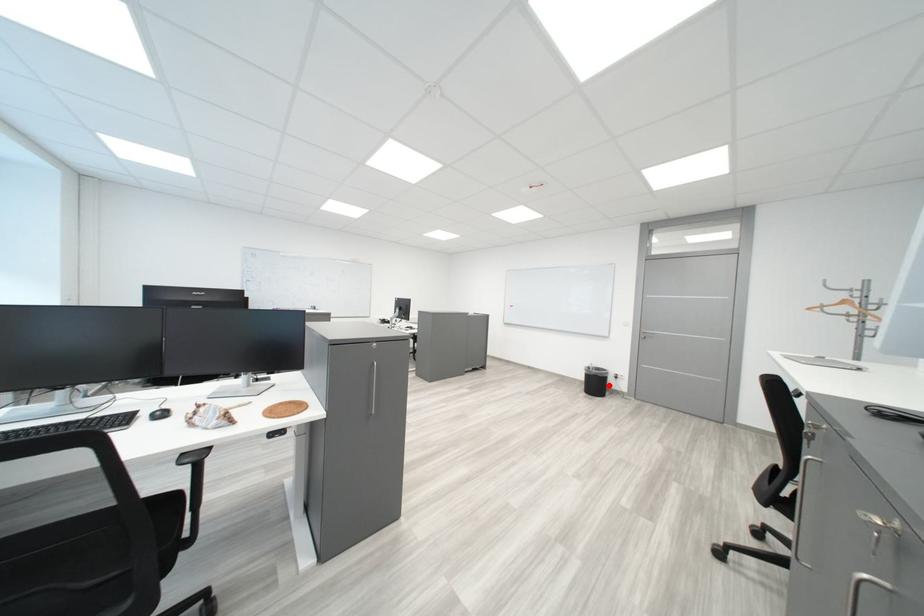
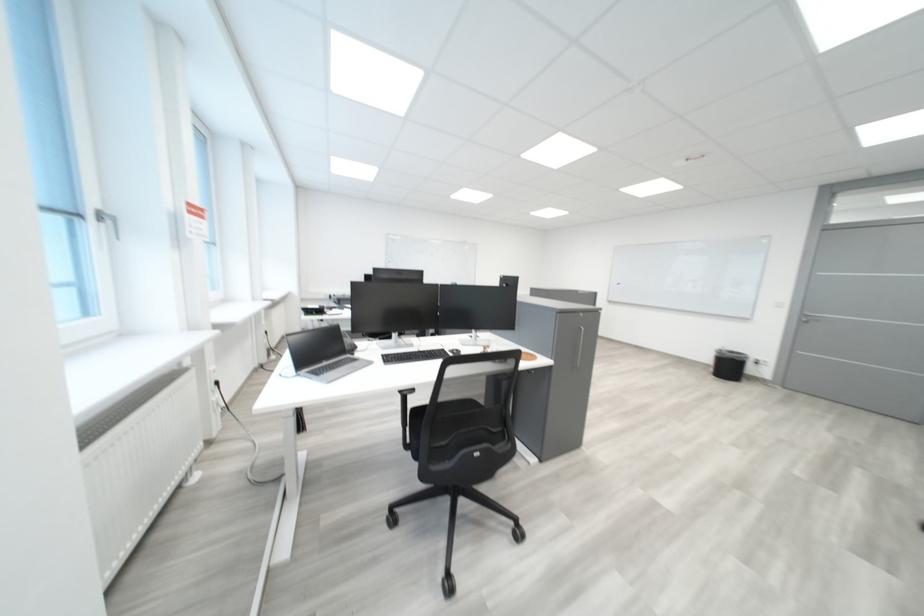
Find the pixel in the second image that matches the highlighted location in the first image.

(743, 369)